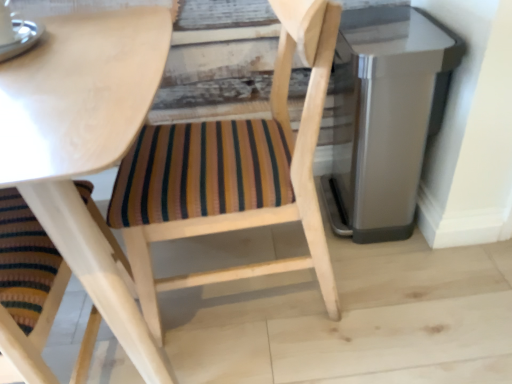
Locate an element on the screen. satin silver trash can at right is located at coordinates (385, 117).

What do you see at coordinates (385, 117) in the screenshot?
I see `satin silver trash can at right` at bounding box center [385, 117].

This screenshot has height=384, width=512. Describe the element at coordinates (233, 173) in the screenshot. I see `wooden chair with striped cushion at center` at that location.

Identify the location of wooden chair with striped cushion at center. The width and height of the screenshot is (512, 384). (233, 173).

This screenshot has width=512, height=384. Identify the location of satin silver trash can at right. (385, 117).

Can you confirm if satin silver trash can at right is positioned to the left of wooden chair with striped cushion at center?

No.

Consider the image. Considering the positions of objects satin silver trash can at right and wooden chair with striped cushion at center in the image provided, who is behind, satin silver trash can at right or wooden chair with striped cushion at center?

Positioned behind is satin silver trash can at right.

Which is in front, point (369, 174) or point (315, 73)?

The point (315, 73) is in front.

From the image's perspective, is satin silver trash can at right below wooden chair with striped cushion at center?

No, from the image's perspective, satin silver trash can at right is not beneath wooden chair with striped cushion at center.

From a real-world perspective, who is located lower, satin silver trash can at right or wooden chair with striped cushion at center?

satin silver trash can at right, from a real-world perspective.

Is satin silver trash can at right thinner than wooden chair with striped cushion at center?

Yes, satin silver trash can at right is thinner than wooden chair with striped cushion at center.

In terms of height, does satin silver trash can at right look taller or shorter compared to wooden chair with striped cushion at center?

Considering their sizes, satin silver trash can at right has less height than wooden chair with striped cushion at center.

Can you confirm if satin silver trash can at right is smaller than wooden chair with striped cushion at center?

Correct, satin silver trash can at right occupies less space than wooden chair with striped cushion at center.

Do you think satin silver trash can at right is within wooden chair with striped cushion at center, or outside of it?

satin silver trash can at right is outside wooden chair with striped cushion at center.

Are satin silver trash can at right and wooden chair with striped cushion at center making contact?

No, satin silver trash can at right is not beside wooden chair with striped cushion at center.

Is satin silver trash can at right turned away from wooden chair with striped cushion at center?

That's not correct — satin silver trash can at right is not looking away from wooden chair with striped cushion at center.

You are a GUI agent. You are given a task and a screenshot of the screen. Output one action in this format:
    pyautogui.click(x=<x>, y=<y>)
    Task: Click on the chair in front of the satin silver trash can at right
    The height and width of the screenshot is (384, 512).
    Given the screenshot: What is the action you would take?
    pyautogui.click(x=233, y=173)

Is wooden chair with striped cushion at center at the right side of satin silver trash can at right?

Incorrect, wooden chair with striped cushion at center is not on the right side of satin silver trash can at right.

Is wooden chair with striped cushion at center positioned before satin silver trash can at right?

That is True.

Considering the positions of point (165, 203) and point (426, 61), is point (165, 203) closer or farther from the camera than point (426, 61)?

Point (165, 203) is closer to the camera than point (426, 61).

From the image's perspective, does wooden chair with striped cushion at center appear higher than satin silver trash can at right?

Actually, wooden chair with striped cushion at center appears below satin silver trash can at right in the image.

From a real-world perspective, is wooden chair with striped cushion at center located beneath satin silver trash can at right?

No, from a real-world perspective, wooden chair with striped cushion at center is not under satin silver trash can at right.

Looking at this image, which of these two, wooden chair with striped cushion at center or satin silver trash can at right, is wider?

Wider between the two is wooden chair with striped cushion at center.

Between wooden chair with striped cushion at center and satin silver trash can at right, which one has less height?

satin silver trash can at right is shorter.

Is wooden chair with striped cushion at center bigger than satin silver trash can at right?

Yes, wooden chair with striped cushion at center is bigger than satin silver trash can at right.

Is wooden chair with striped cushion at center positioned beyond the bounds of satin silver trash can at right?

wooden chair with striped cushion at center is positioned outside satin silver trash can at right.

Does wooden chair with striped cushion at center touch satin silver trash can at right?

wooden chair with striped cushion at center and satin silver trash can at right are clearly separated.

Could you tell me if wooden chair with striped cushion at center is facing satin silver trash can at right?

No, wooden chair with striped cushion at center is not turned towards satin silver trash can at right.

How many degrees apart are the facing directions of wooden chair with striped cushion at center and satin silver trash can at right?

The angle between the facing direction of wooden chair with striped cushion at center and the facing direction of satin silver trash can at right is 91 degrees.

Measure the distance between wooden chair with striped cushion at center and satin silver trash can at right.

wooden chair with striped cushion at center is 16.16 inches from satin silver trash can at right.

Identify the location of chair in front of the satin silver trash can at right. Image resolution: width=512 pixels, height=384 pixels. (233, 173).

Identify the location of appliance behind the wooden chair with striped cushion at center. pos(385,117).

Identify the location of chair that is above the satin silver trash can at right (from a real-world perspective). The width and height of the screenshot is (512, 384). (233, 173).